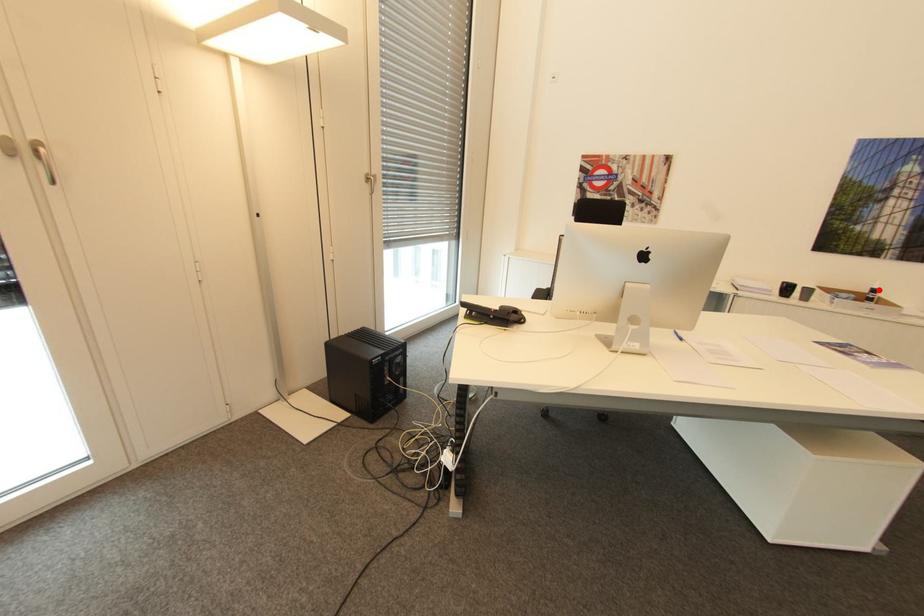
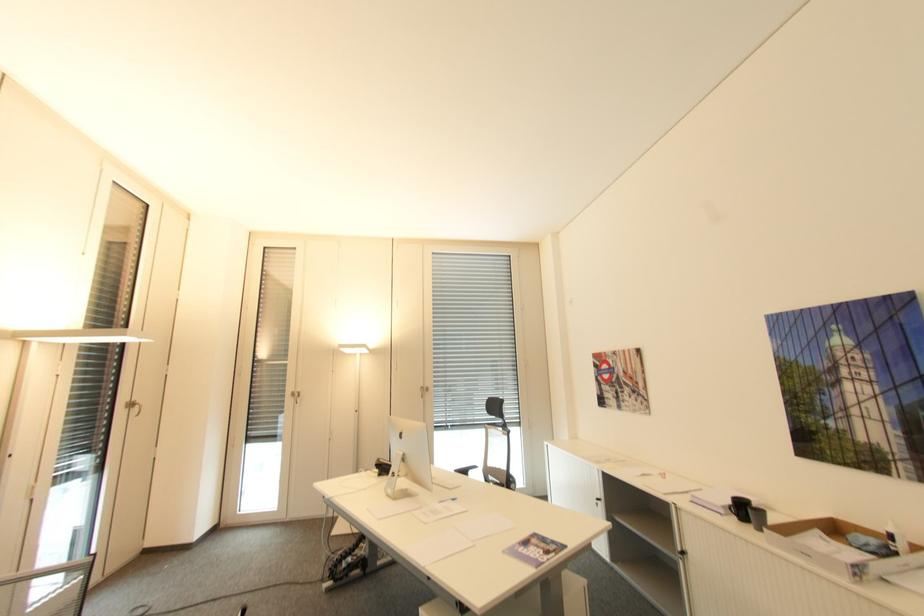
Where in the second image is the point corresponding to the highlighted location from the first image?

(895, 537)